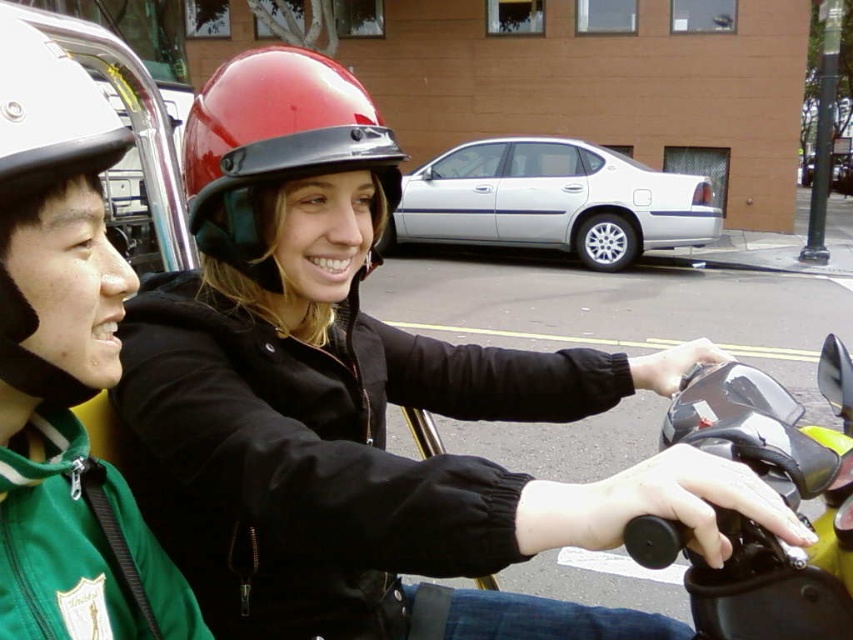
Question: Is red glossy helmet at center smaller than white matte helmet at left?

Choices:
 (A) yes
 (B) no

Answer: (B)

Question: Can you confirm if shiny black handlebars at center is positioned above red glossy helmet at center?

Choices:
 (A) yes
 (B) no

Answer: (B)

Question: Based on their relative distances, which object is nearer to the white matte helmet at left?

Choices:
 (A) shiny black handlebars at center
 (B) red glossy helmet at center

Answer: (B)

Question: Which is nearer to the shiny black handlebars at center?

Choices:
 (A) white matte helmet at left
 (B) red glossy helmet at center

Answer: (A)

Question: Which object is positioned farthest from the red glossy helmet at center?

Choices:
 (A) white matte helmet at left
 (B) shiny black handlebars at center

Answer: (B)

Question: Can you confirm if shiny black handlebars at center is smaller than white matte helmet at left?

Choices:
 (A) yes
 (B) no

Answer: (B)